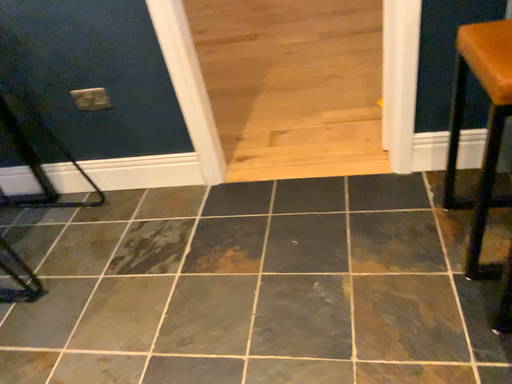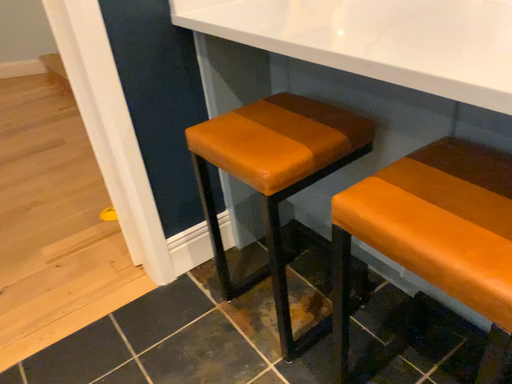
Question: How did the camera likely rotate when shooting the video?

Choices:
 (A) rotated left
 (B) rotated right

Answer: (B)